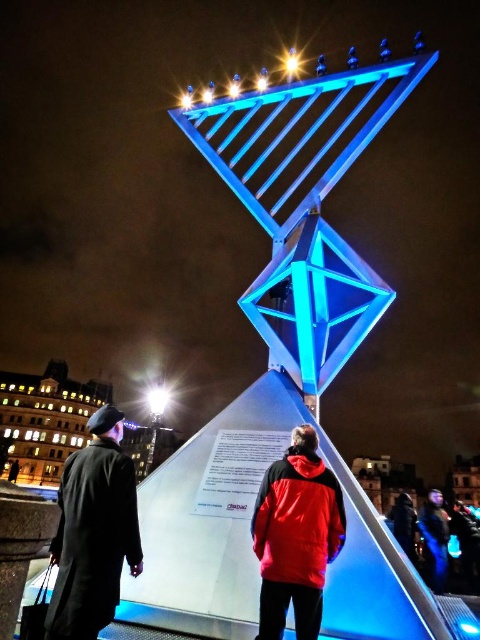
You are an event organizer setting up for a night event. You need to ensure that the dark wool coat at left and the bright white bulb at center are visible to attendees. Considering their heights, which object might require additional lighting to ensure visibility?

The dark wool coat at left is much taller than the bright white bulb at center, so it might require additional lighting to ensure its visibility.

You are an event organizer planning to place a new decorative item between the red matte jacket at center and the bright white bulb at center. Based on their sizes, which object should the new item be placed closer to?

The new decorative item should be placed closer to the bright white bulb at center because the red matte jacket at center occupies less space, meaning the bright white bulb at center is larger and requires more space between them.